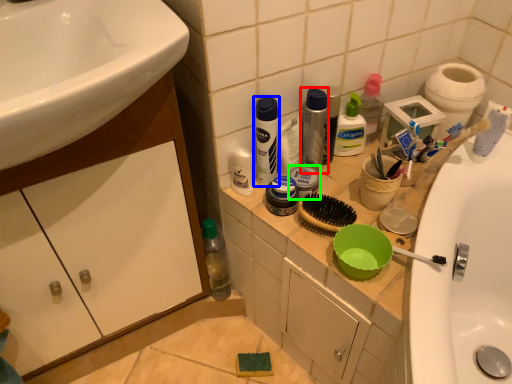
Question: Based on their relative distances, which object is nearer to toiletry (highlighted by a red box)? Choose from mouthwash (highlighted by a blue box) and toiletry (highlighted by a green box).

Choices:
 (A) mouthwash
 (B) toiletry

Answer: (B)